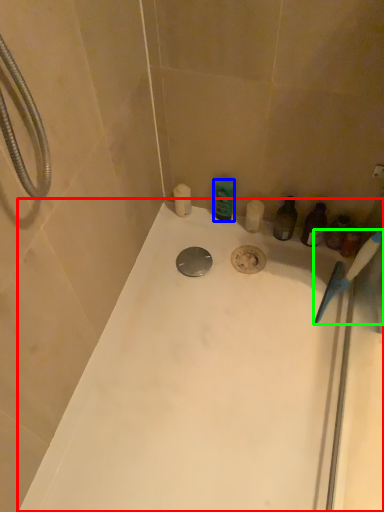
Question: Estimate the real-world distances between objects in this image. Which object is closer to bathtub (highlighted by a red box), toiletry (highlighted by a blue box) or toothbrush (highlighted by a green box)?

Choices:
 (A) toiletry
 (B) toothbrush

Answer: (B)